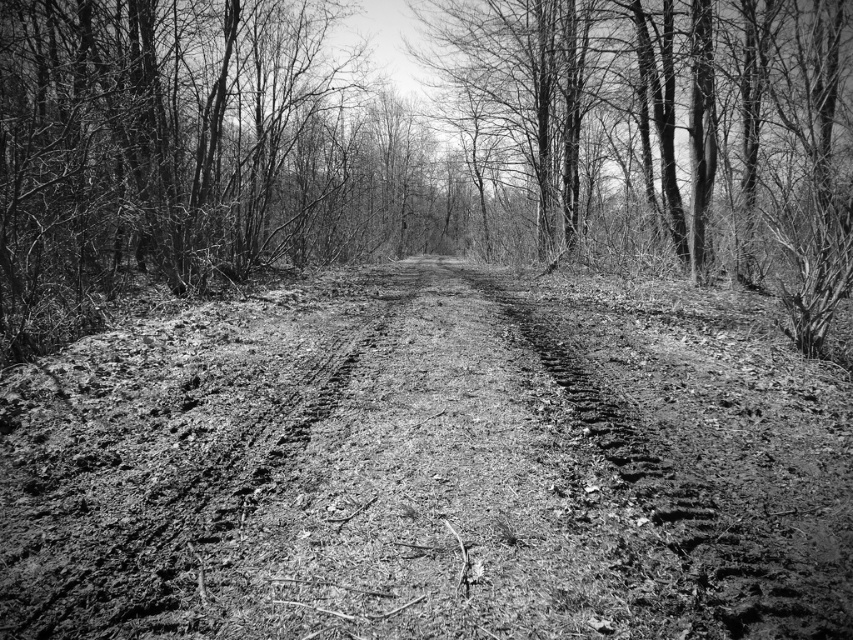
Consider the image. You are a hiker carrying a 2 meter wide tent. You need to set up camp along the path. Can the dirt track at center accommodate your tent without overlapping the smooth bark tree at center?

The dirt track at center has a lesser width compared to smooth bark tree at center, so the tent may not fit without overlapping since the track is narrower than the tree.

You are a hiker trying to determine the elevation changes along the path. Which object between the dirt track at center and the smooth bark tree at center has a higher elevation?

The smooth bark tree at center has a greater height than the dirt track at center, so the smooth bark tree at center is at a higher elevation.

You are standing at the starting point of the forest path and see two points marked on the ground. The first point is labeled as point (144,548) and the second is point (814,243). If you walk straight ahead along the path, which point will you encounter first?

Point (144,548) is in front of point (814,243), so you will encounter point (144,548) first as you walk straight ahead along the path.